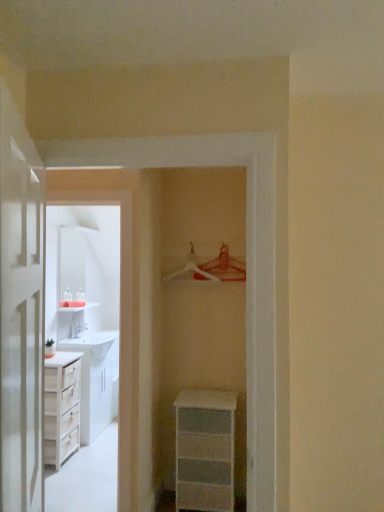
Question: From the image's perspective, would you say white wood cabinet at left is positioned over metallic silver hanger at upper center, the 1th hanger positioned from the right?

Choices:
 (A) yes
 (B) no

Answer: (B)

Question: Is white wood cabinet at left wider than metallic silver hanger at upper center, the 1th hanger positioned from the right?

Choices:
 (A) no
 (B) yes

Answer: (B)

Question: Is white wood cabinet at left placed right next to metallic silver hanger at upper center, the 1th hanger positioned from the right?

Choices:
 (A) no
 (B) yes

Answer: (A)

Question: Can you confirm if white wood cabinet at left is thinner than metallic silver hanger at upper center, the second hanger from the left?

Choices:
 (A) yes
 (B) no

Answer: (B)

Question: Does white wood cabinet at left have a greater height compared to metallic silver hanger at upper center, the second hanger from the left?

Choices:
 (A) yes
 (B) no

Answer: (A)

Question: Considering the relative positions of white wood cabinet at left and metallic silver hanger at upper center, the second hanger from the left, in the image provided, is white wood cabinet at left to the left of metallic silver hanger at upper center, the second hanger from the left, from the viewer's perspective?

Choices:
 (A) yes
 (B) no

Answer: (A)

Question: Does white plastic chest of drawers at lower center have a lesser height compared to white plastic hanger at center, arranged as the second hanger when viewed from the right?

Choices:
 (A) no
 (B) yes

Answer: (A)

Question: Is white plastic hanger at center, acting as the 1th hanger starting from the left, a part of white plastic chest of drawers at lower center?

Choices:
 (A) yes
 (B) no

Answer: (B)

Question: From the image's perspective, is white plastic chest of drawers at lower center under white plastic hanger at center, arranged as the second hanger when viewed from the right?

Choices:
 (A) no
 (B) yes

Answer: (B)

Question: Considering the relative sizes of white plastic chest of drawers at lower center and white plastic hanger at center, acting as the 1th hanger starting from the left, in the image provided, is white plastic chest of drawers at lower center bigger than white plastic hanger at center, acting as the 1th hanger starting from the left,?

Choices:
 (A) yes
 (B) no

Answer: (A)

Question: Is white plastic chest of drawers at lower center positioned behind white plastic hanger at center, acting as the 1th hanger starting from the left?

Choices:
 (A) no
 (B) yes

Answer: (A)

Question: Could you tell me if white plastic chest of drawers at lower center is facing white plastic hanger at center, acting as the 1th hanger starting from the left?

Choices:
 (A) yes
 (B) no

Answer: (B)

Question: Does white wood cabinet at left have a lesser height compared to white glossy door at left?

Choices:
 (A) no
 (B) yes

Answer: (A)